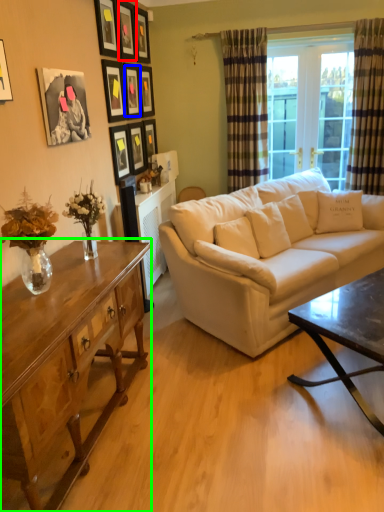
Question: Based on their relative distances, which object is nearer to picture frame (highlighted by a red box)? Choose from picture frame (highlighted by a blue box) and coffee table (highlighted by a green box).

Choices:
 (A) picture frame
 (B) coffee table

Answer: (A)